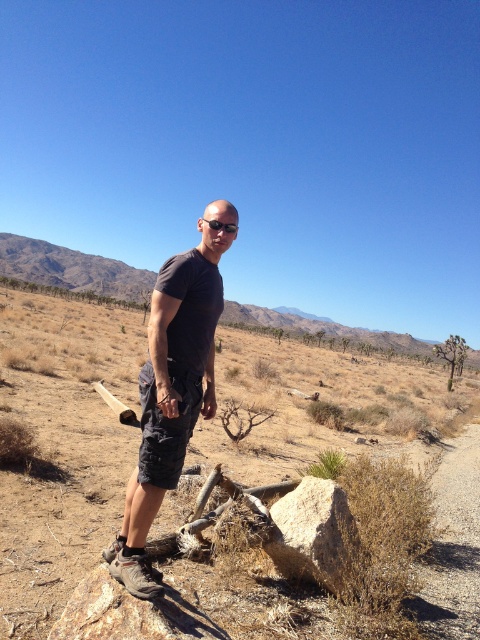
Between smooth gray rock at center and matte black goggles at center, which one is positioned lower?

smooth gray rock at center

Image resolution: width=480 pixels, height=640 pixels. What are the coordinates of `smooth gray rock at center` in the screenshot? It's located at (312, 532).

At what (x,y) coordinates should I click in order to perform the action: click on smooth gray rock at center. Please return your answer as a coordinate pair (x, y). This screenshot has height=640, width=480. Looking at the image, I should click on (312, 532).

Is dark gray t-shirt at center to the left of matte black goggles at center from the viewer's perspective?

Indeed, dark gray t-shirt at center is positioned on the left side of matte black goggles at center.

Is point (213, 412) positioned in front of point (216, 228)?

No, it is not.

The width and height of the screenshot is (480, 640). What are the coordinates of `dark gray t-shirt at center` in the screenshot? It's located at (170, 396).

Does dark gray t-shirt at center have a lesser height compared to smooth gray rock at center?

No, dark gray t-shirt at center is not shorter than smooth gray rock at center.

Can you confirm if dark gray t-shirt at center is positioned to the right of smooth gray rock at center?

Incorrect, dark gray t-shirt at center is not on the right side of smooth gray rock at center.

Locate an element on the screen. This screenshot has height=640, width=480. dark gray t-shirt at center is located at coordinates (170, 396).